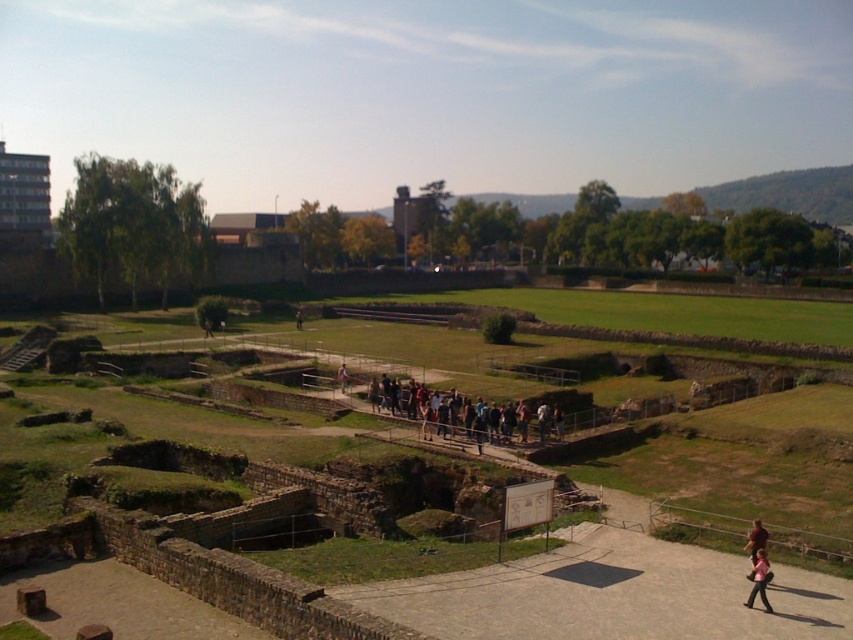
Which is more to the left, smooth stone pathway at center or brown leather jacket at lower right?

Positioned to the left is smooth stone pathway at center.

Is smooth stone pathway at center bigger than brown leather jacket at lower right?

Correct, smooth stone pathway at center is larger in size than brown leather jacket at lower right.

Locate an element on the screen. smooth stone pathway at center is located at coordinates (611, 595).

Which is below, pink fabric person at lower right or light brown wooden bench at center?

pink fabric person at lower right is lower down.

Locate an element on the screen. The width and height of the screenshot is (853, 640). pink fabric person at lower right is located at coordinates (759, 580).

Who is positioned more to the right, smooth stone pathway at center or pink fabric person at lower right?

pink fabric person at lower right

Can you confirm if smooth stone pathway at center is positioned to the left of pink fabric person at lower right?

Correct, you'll find smooth stone pathway at center to the left of pink fabric person at lower right.

Identify the location of smooth stone pathway at center. (611, 595).